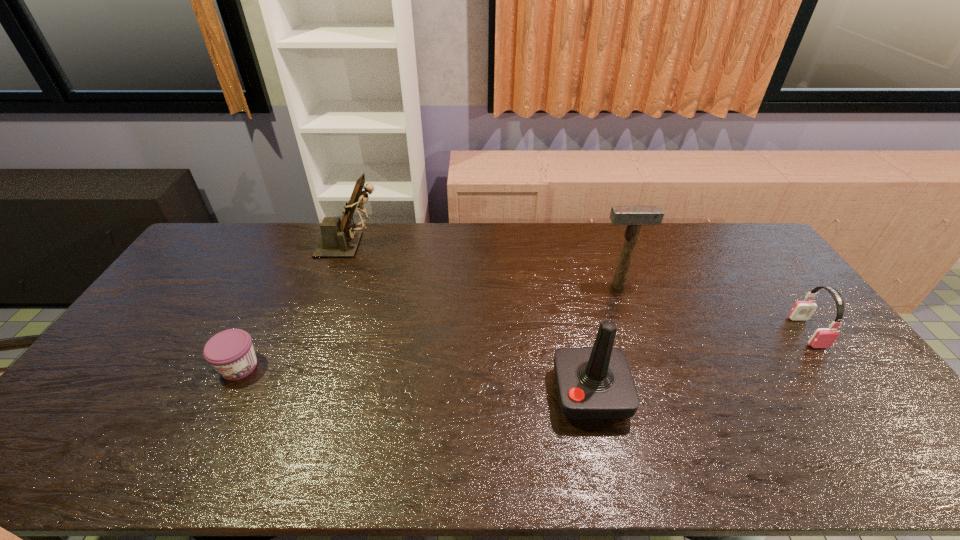
Identify the location of vacant point located between the second object from left to right and the fourth object from left to right. This screenshot has height=540, width=960. (485, 265).

At what (x,y) coordinates should I click in order to perform the action: click on free space between the jam and the joystick. Please return your answer as a coordinate pair (x, y). This screenshot has height=540, width=960. Looking at the image, I should click on (415, 381).

Identify the location of free spot between the second object from right to left and the jam. This screenshot has width=960, height=540. (428, 326).

Image resolution: width=960 pixels, height=540 pixels. I want to click on vacant area that lies between the second object from left to right and the fourth nearest object, so click(485, 265).

Image resolution: width=960 pixels, height=540 pixels. I want to click on unoccupied position between the fourth nearest object and the rightmost object, so click(x=712, y=309).

You are a GUI agent. You are given a task and a screenshot of the screen. Output one action in this format:
    pyautogui.click(x=<x>, y=<y>)
    Task: Click on the free space that is in between the mallet and the shortest object
    The height and width of the screenshot is (540, 960).
    Given the screenshot: What is the action you would take?
    pyautogui.click(x=428, y=326)

Where is `vacant area that lies between the third farthest object and the fourth object from left to right`? The image size is (960, 540). vacant area that lies between the third farthest object and the fourth object from left to right is located at coordinates (712, 309).

Locate an element on the screen. Image resolution: width=960 pixels, height=540 pixels. vacant space that is in between the joystick and the figurine is located at coordinates (470, 320).

You are a GUI agent. You are given a task and a screenshot of the screen. Output one action in this format:
    pyautogui.click(x=<x>, y=<y>)
    Task: Click on the empty space that is in between the second object from right to left and the rightmost object
    
    Given the screenshot: What is the action you would take?
    pyautogui.click(x=712, y=309)

Locate an element on the screen. object that is the third closest to the shortest object is located at coordinates (633, 216).